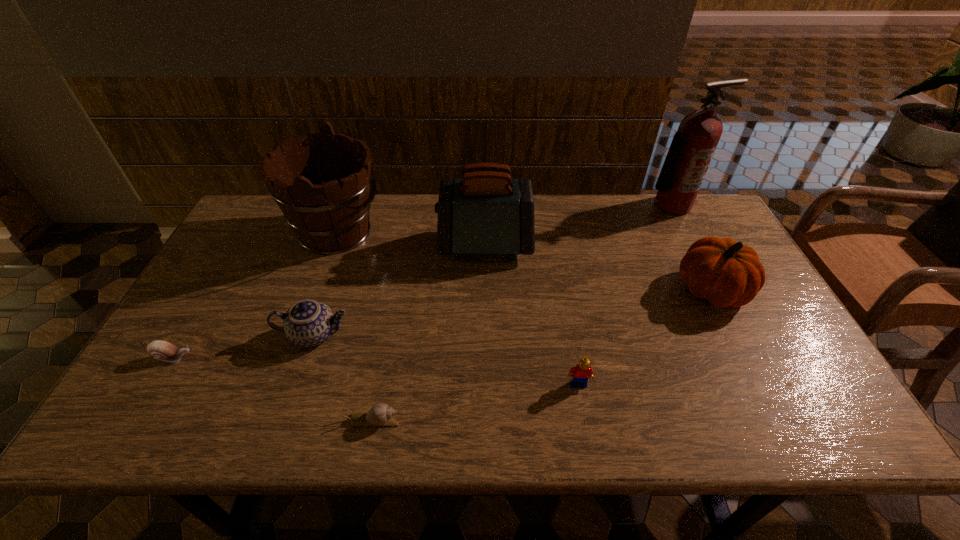
Where is `the shortest object`? This screenshot has width=960, height=540. the shortest object is located at coordinates (380, 414).

Identify the location of free space located on the front of the fire extinguisher near the operation label. This screenshot has width=960, height=540. (698, 254).

The image size is (960, 540). In order to click on free location located 0.320m with the handle on the wine bucket in this screenshot , I will do `click(484, 233)`.

Where is `blank space located on the front-facing side of the fourth object from right to left`? This screenshot has height=540, width=960. blank space located on the front-facing side of the fourth object from right to left is located at coordinates pos(419,246).

The height and width of the screenshot is (540, 960). I want to click on blank area located 0.130m on the front-facing side of the fourth object from right to left, so click(x=396, y=246).

I want to click on vacant position located on the front-facing side of the fourth object from right to left, so click(x=419, y=246).

The image size is (960, 540). I want to click on free space located 0.240m on the front of the fourth tallest object, so tap(768, 400).

Locate an element on the screen. The width and height of the screenshot is (960, 540). vacant point located from the spout of the fourth shortest object is located at coordinates (435, 335).

Identify the location of vacant space located 0.060m on the front-facing side of the second nearest object. This screenshot has width=960, height=540. (584, 413).

Where is `vacant space located on the front-facing side of the leftmost object`? This screenshot has width=960, height=540. vacant space located on the front-facing side of the leftmost object is located at coordinates (252, 357).